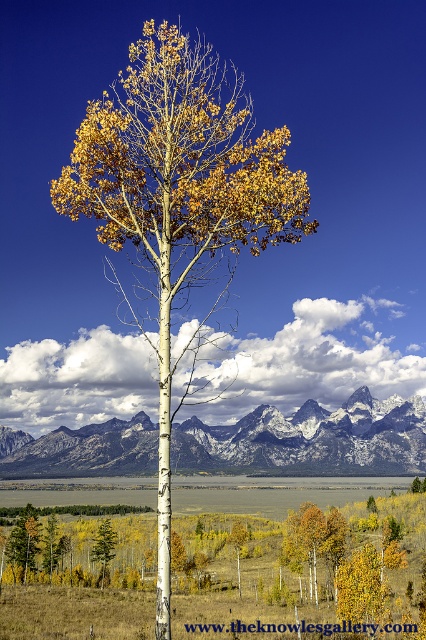
Which is more to the right, matte white birch tree at center or yellow matte tree at center?

matte white birch tree at center

Is point (192, 154) positioned in front of point (104, 522)?

Yes.

At what (x,y) coordinates should I click in order to perform the action: click on matte white birch tree at center. Please return your answer as a coordinate pair (x, y). This screenshot has height=640, width=426. Looking at the image, I should click on (180, 198).

The height and width of the screenshot is (640, 426). Find the location of `snowy granite mountains at center`. snowy granite mountains at center is located at coordinates (311, 438).

Does snowy granite mountains at center have a lesser height compared to golden aspen tree at center?

No.

Is point (317, 428) positioned before point (238, 573)?

No, (317, 428) is further to viewer.

This screenshot has width=426, height=640. I want to click on snowy granite mountains at center, so click(311, 438).

Is point (189, 464) positioned before point (109, 522)?

No, it is behind (109, 522).

Between snowy granite mountains at center and yellow matte tree at center, which one appears on the right side from the viewer's perspective?

snowy granite mountains at center

Is point (305, 445) farther from viewer compared to point (101, 552)?

Yes, point (305, 445) is farther from viewer.

Where is `snowy granite mountains at center`? The image size is (426, 640). snowy granite mountains at center is located at coordinates (311, 438).